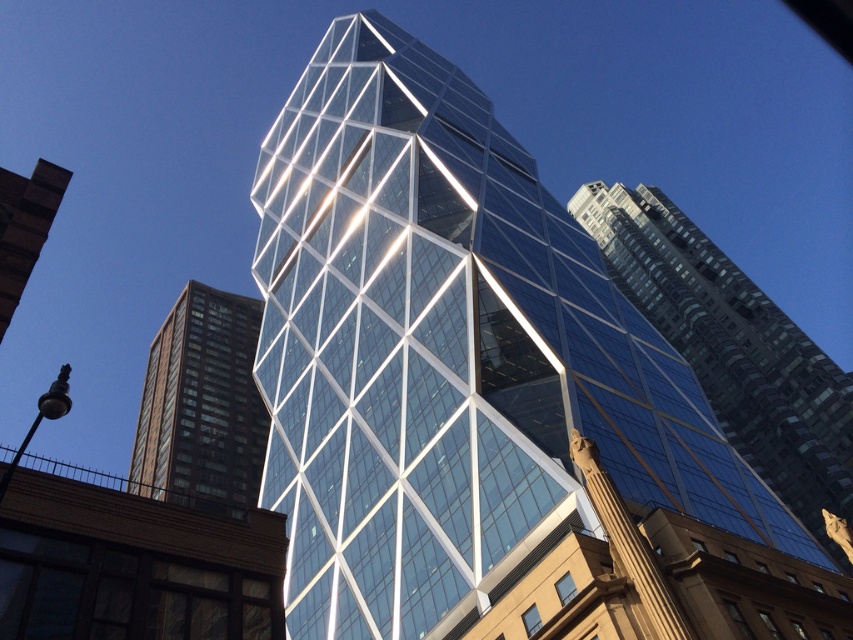
Question: Can you confirm if transparent glass tower at center is wider than brown glass building at left?

Choices:
 (A) yes
 (B) no

Answer: (A)

Question: Estimate the real-world distances between objects in this image. Which object is closer to the brown glass building at left?

Choices:
 (A) transparent glass tower at center
 (B) transparent glass skyscraper at center

Answer: (A)

Question: Which point is closer to the camera taking this photo?

Choices:
 (A) (434, 188)
 (B) (7, 310)
 (C) (202, 490)

Answer: (B)

Question: Which point appears closest to the camera in this image?

Choices:
 (A) (543, 576)
 (B) (773, 307)

Answer: (A)

Question: Does transparent glass skyscraper at center appear on the left side of clear glass skyscraper at upper center?

Choices:
 (A) yes
 (B) no

Answer: (B)

Question: Can you confirm if transparent glass tower at center is wider than transparent glass skyscraper at center?

Choices:
 (A) yes
 (B) no

Answer: (A)